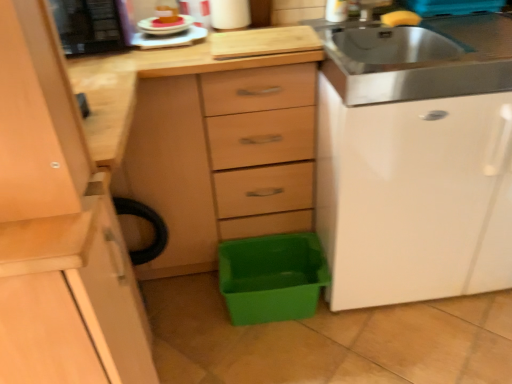
Question: Does stainless steel sink at upper right touch white glossy plate at upper center, which is counted as the second appliance, starting from the left?

Choices:
 (A) no
 (B) yes

Answer: (A)

Question: Is stainless steel sink at upper right positioned with its back to white glossy plate at upper center, which is counted as the second appliance, starting from the left?

Choices:
 (A) yes
 (B) no

Answer: (B)

Question: Is stainless steel sink at upper right to the left of white glossy plate at upper center, which is the first appliance from right to left, from the viewer's perspective?

Choices:
 (A) yes
 (B) no

Answer: (B)

Question: Could you tell me if stainless steel sink at upper right is facing white glossy plate at upper center, which is the first appliance from right to left?

Choices:
 (A) no
 (B) yes

Answer: (A)

Question: Considering the relative sizes of stainless steel sink at upper right and white glossy plate at upper center, which is the first appliance from right to left, in the image provided, is stainless steel sink at upper right shorter than white glossy plate at upper center, which is the first appliance from right to left,?

Choices:
 (A) yes
 (B) no

Answer: (B)

Question: Would you say stainless steel sink at upper right is to the left or to the right of green plastic storage box at lower center in the picture?

Choices:
 (A) right
 (B) left

Answer: (A)

Question: Is point (421, 96) positioned closer to the camera than point (254, 306)?

Choices:
 (A) farther
 (B) closer

Answer: (B)

Question: Considering their positions, is stainless steel sink at upper right located in front of or behind green plastic storage box at lower center?

Choices:
 (A) behind
 (B) front

Answer: (B)

Question: From a real-world perspective, is stainless steel sink at upper right physically located above or below green plastic storage box at lower center?

Choices:
 (A) below
 (B) above

Answer: (B)

Question: Considering the positions of point (435, 87) and point (190, 36), is point (435, 87) closer or farther from the camera than point (190, 36)?

Choices:
 (A) farther
 (B) closer

Answer: (B)

Question: Is stainless steel sink at upper right in front of or behind white glossy plate at upper center, which is the first appliance from right to left, in the image?

Choices:
 (A) behind
 (B) front

Answer: (B)

Question: Is stainless steel sink at upper right situated inside white glossy plate at upper center, which is counted as the second appliance, starting from the left, or outside?

Choices:
 (A) inside
 (B) outside

Answer: (B)

Question: Looking at their shapes, would you say stainless steel sink at upper right is wider or thinner than white glossy plate at upper center, which is the first appliance from right to left?

Choices:
 (A) thin
 (B) wide

Answer: (B)

Question: From the image's perspective, relative to pink frosted cake at upper left, placed as the second food when sorted from right to left, is black plastic microwave at upper left, which ranks as the 2th appliance in right-to-left order, above or below?

Choices:
 (A) above
 (B) below

Answer: (A)

Question: Would you say black plastic microwave at upper left, which ranks as the 2th appliance in right-to-left order, is inside or outside pink frosted cake at upper left, placed as the second food when sorted from right to left?

Choices:
 (A) outside
 (B) inside

Answer: (A)